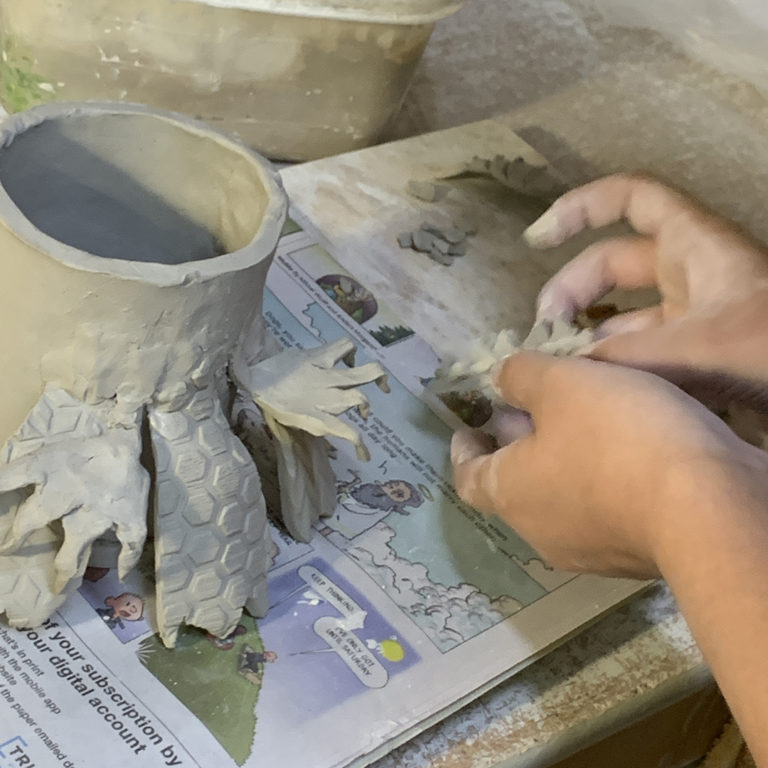
You are a GUI agent. You are given a task and a screenshot of the screen. Output one action in this format:
    pyautogui.click(x=<x>, y=<y>)
    Task: Click on the pottery item
    The height and width of the screenshot is (768, 768).
    Given the screenshot: What is the action you would take?
    pyautogui.click(x=144, y=285)